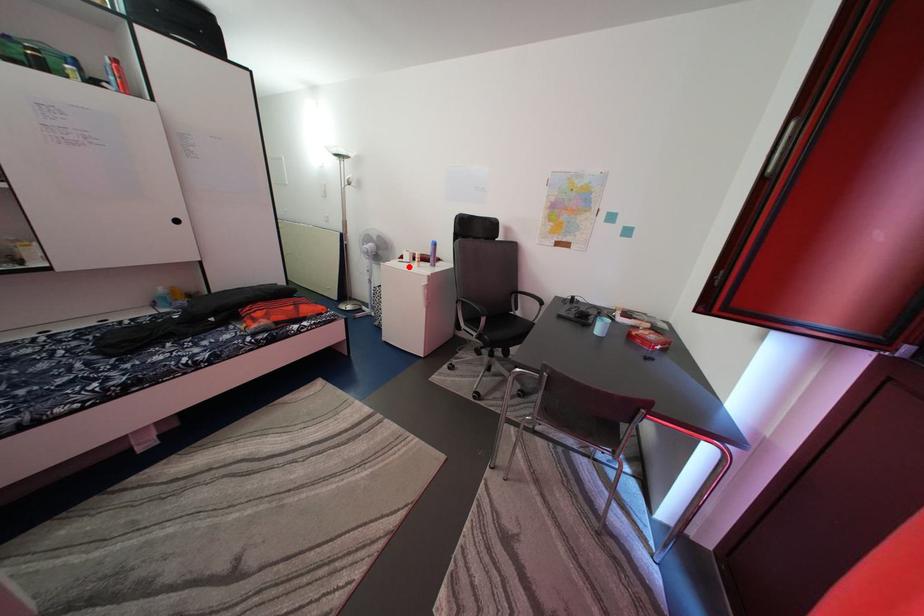
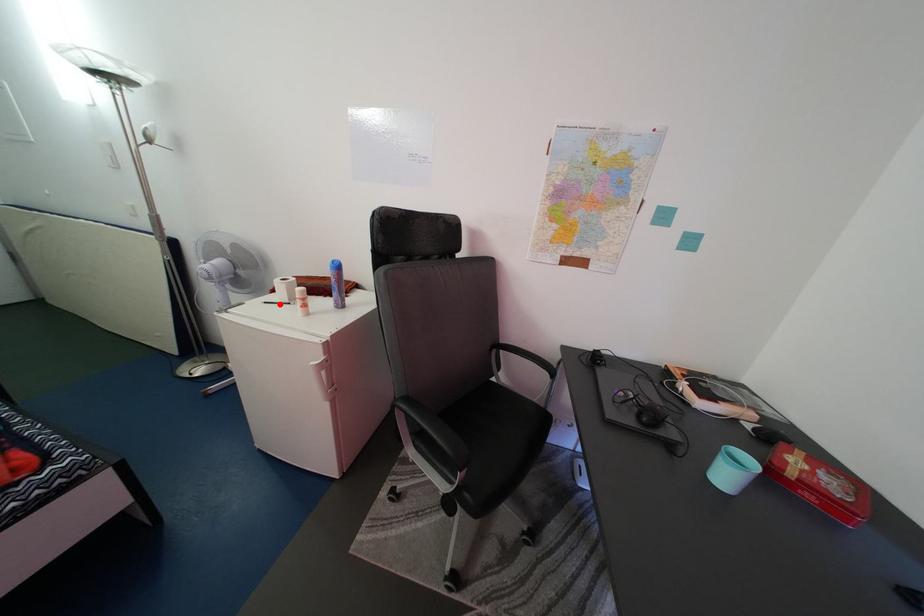
I am providing you with two images of the same scene from different viewpoints. A red point is marked on the first image and another point is marked on the second image. Is the red point in image1 aligned with the point shown in image2?

Yes